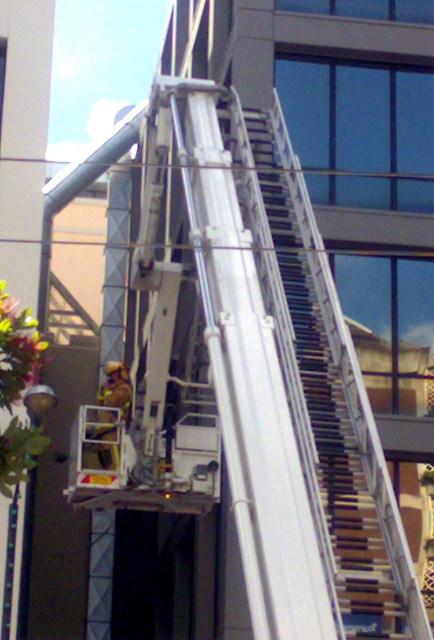
Can you confirm if white wooden stairs at upper right is positioned below orange reflective safety vest at center?

No.

What are the coordinates of `white wooden stairs at upper right` in the screenshot? It's located at (325, 392).